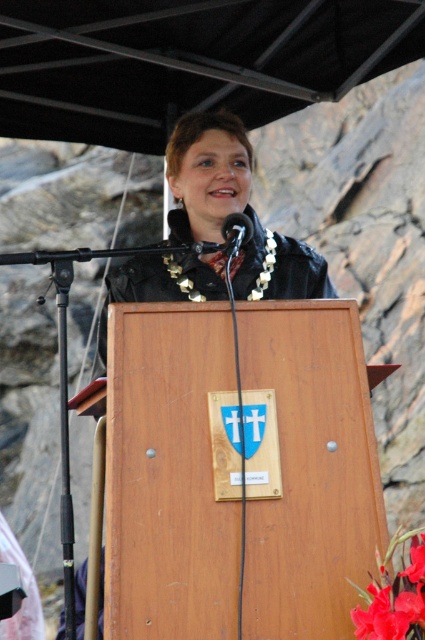
Question: Can you confirm if black matte canopy at upper center is bigger than black plastic microphone at center?

Choices:
 (A) no
 (B) yes

Answer: (B)

Question: Which object appears farthest from the camera in this image?

Choices:
 (A) black matte canopy at upper center
 (B) black plastic microphone at center

Answer: (A)

Question: Is black matte canopy at upper center to the left of black plastic microphone at center from the viewer's perspective?

Choices:
 (A) yes
 (B) no

Answer: (A)

Question: Which of the following is the farthest from the observer?

Choices:
 (A) (380, 564)
 (B) (231, 216)

Answer: (B)

Question: Is glossy floral at center bigger than black plastic microphone at center?

Choices:
 (A) yes
 (B) no

Answer: (A)

Question: Based on their relative distances, which object is farther from the glossy floral at center?

Choices:
 (A) black plastic microphone at center
 (B) black matte canopy at upper center

Answer: (B)